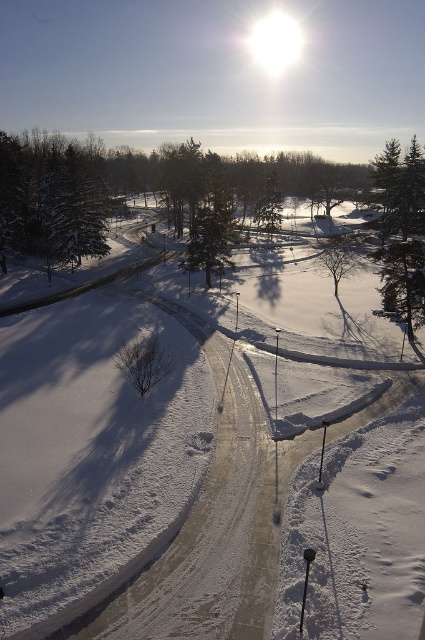
You are an outdoor photographer planning to capture the winter scene. You have a camera with a wide angle lens that can capture up to 120 degrees. The white snow at center and the green textured pine tree at right are both in your frame. Which object will appear smaller in the final photo?

The white snow at center will appear smaller in the final photo because it is thinner than the green textured pine tree at right.

You are an outdoor photographer planning to take a photo of the white snow at center and the green textured pine tree at right. You want to ensure both subjects are in focus. Given that your camera can focus on objects within a 25 meter range, will you be able to capture both subjects clearly in the same shot?

The white snow at center and green textured pine tree at right are 27.33 meters apart, which exceeds the camera focus range of 25 meters. Therefore, both subjects cannot be in focus simultaneously in the same shot.